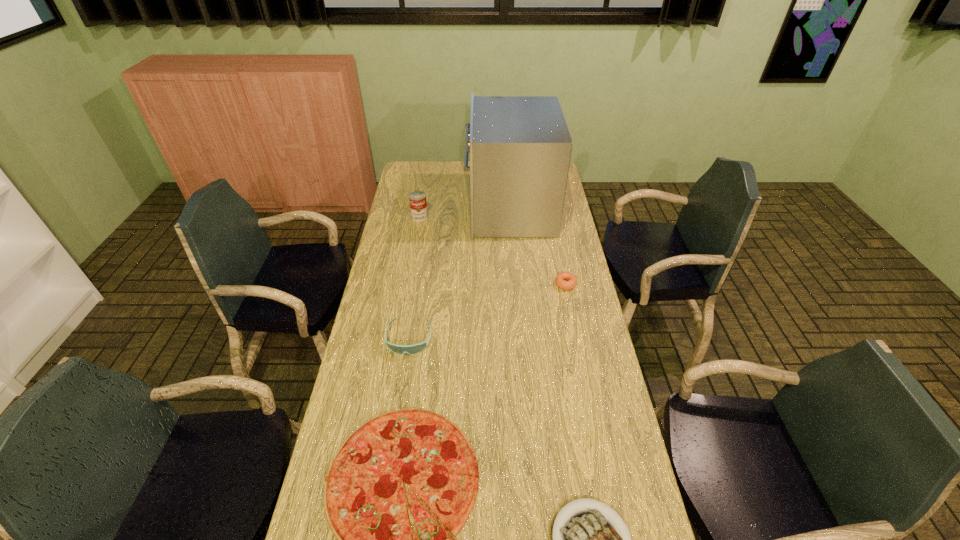
Where is `vacant space located on the front of the doughnut`? The image size is (960, 540). vacant space located on the front of the doughnut is located at coordinates (x=575, y=328).

Where is `object at the far edge`? The image size is (960, 540). object at the far edge is located at coordinates (520, 147).

At what (x,y) coordinates should I click in order to perform the action: click on can that is at the left edge. Please return your answer as a coordinate pair (x, y). This screenshot has width=960, height=540. Looking at the image, I should click on (417, 199).

Identify the location of goggles present at the left edge. (416, 348).

Find the location of a particular element. This screenshot has height=540, width=960. toaster oven that is at the right edge is located at coordinates (520, 147).

Where is `doughnut that is positioned at the right edge`? This screenshot has width=960, height=540. doughnut that is positioned at the right edge is located at coordinates (560, 280).

I want to click on object at the far right corner, so click(x=520, y=147).

This screenshot has width=960, height=540. Identify the location of vacant space at the far edge of the desktop. (435, 172).

The width and height of the screenshot is (960, 540). I want to click on free space at the left edge of the desktop, so click(x=383, y=402).

Where is `free space at the right edge`? This screenshot has height=540, width=960. free space at the right edge is located at coordinates (555, 304).